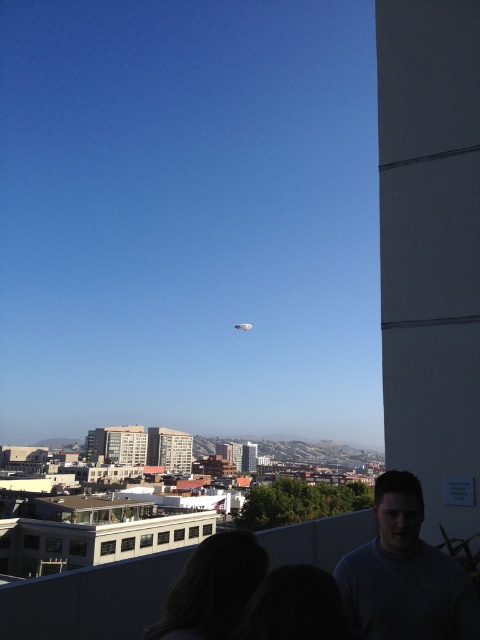
You are standing on the rooftop and want to take a photo of the city. You have two points marked on your camera screen at coordinates point (434,573) and point (244,596). Which point is closer to you?

Point (434,573) is further to the camera than point (244,596), so the point closer to you is point (244,596).

You are standing at the edge of the rooftop and want to throw a ball to a friend who is holding a dark gray sweater at lower right. If you can throw the ball 20 meters, will you be able to reach them?

The distance between you and the dark gray sweater at lower right is 16.93 meters, so yes, you can reach them since your throw can go 20 meters which is farther than the required distance.